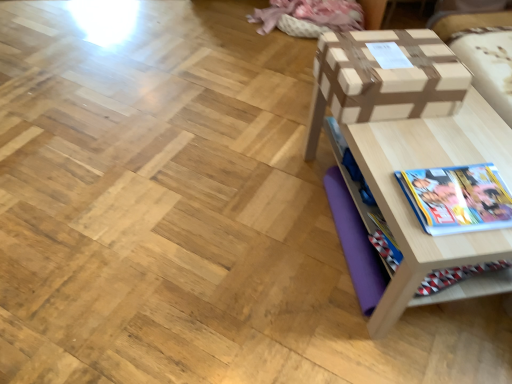
The height and width of the screenshot is (384, 512). I want to click on vacant area that is in front of brown cardboard box at upper right, so click(x=412, y=150).